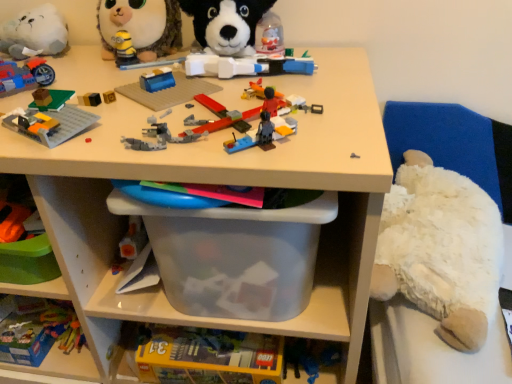
Find the location of a particular element. Image resolution: width=512 pixels, height=384 pixels. vacant area that lies between white plush dog at upper center, the seventh toy viewed from the left, and translucent plastic baseplate at upper left, the fifth toy from the right is located at coordinates (154, 89).